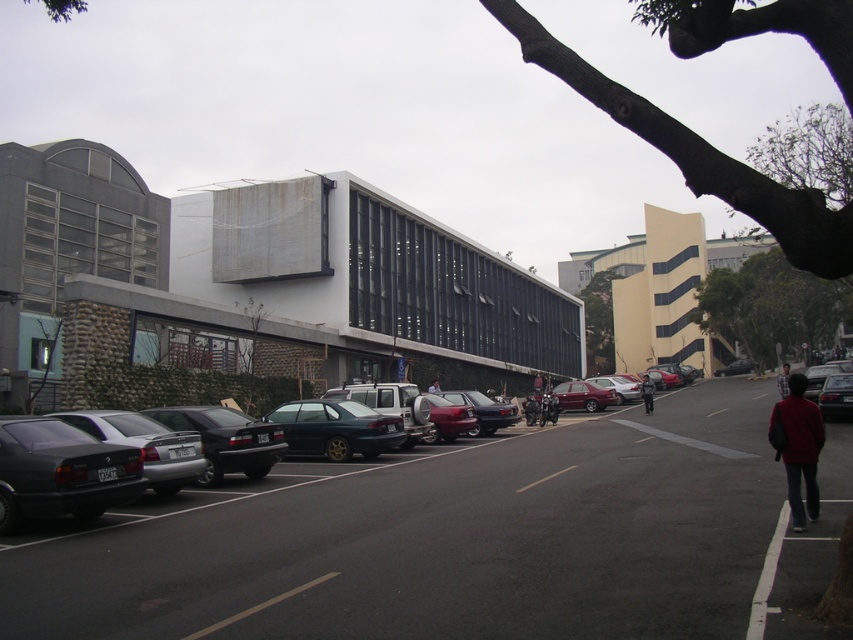
You are a pedestrian standing at the blue denim jeans at lower right location. You need to cross the street to reach the modern building with scaffolding. The white painted line at lower right marks the start of the sidewalk. Can you safely cross the road before a car parked nearby moves forward? Assume cars can move at 5 m per second and you walk at 1.5 m per second.

The distance between the blue denim jeans at lower right and the white painted line at lower right is 46.40 meters. To reach the white painted line, you would need to cover this distance. However, given your walking speed of 1.5 m per second, it would take approximately 30.9 seconds to reach the line. Meanwhile, a car moving at 5 m per second could cover the same distance in about 9.3 seconds. This means the car could reach the white painted line before you, posing a safety risk. Therefore, it is not safe.

You are a pedestrian standing on the sidewalk and want to cross the street. You see a white painted line at lower right and blue denim jeans at lower right. Which object is closer to you as you prepare to step onto the road?

The white painted line at lower right is closer to the viewer than blue denim jeans at lower right, so the white painted line at lower right is closer to you.